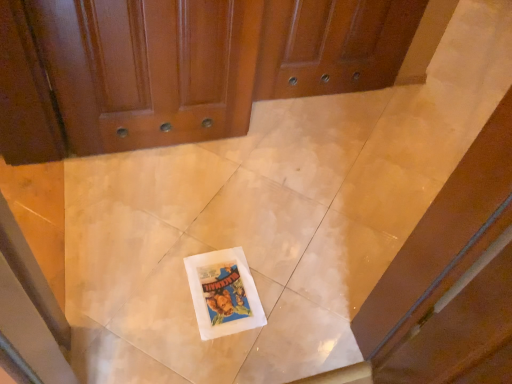
This screenshot has width=512, height=384. Find the location of `vacant region above white paper comic book at center (from a real-world perspective)`. vacant region above white paper comic book at center (from a real-world perspective) is located at coordinates (222, 284).